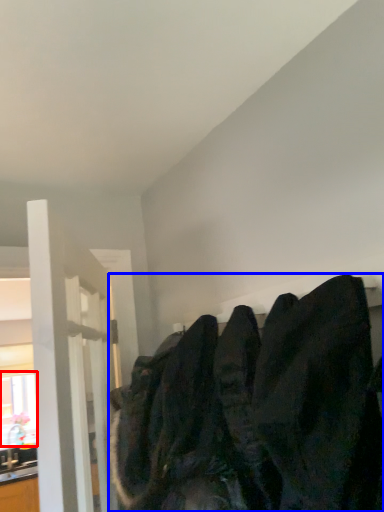
Question: Which object is closer to the camera taking this photo, window (highlighted by a red box) or sweatshirt (highlighted by a blue box)?

Choices:
 (A) window
 (B) sweatshirt

Answer: (B)